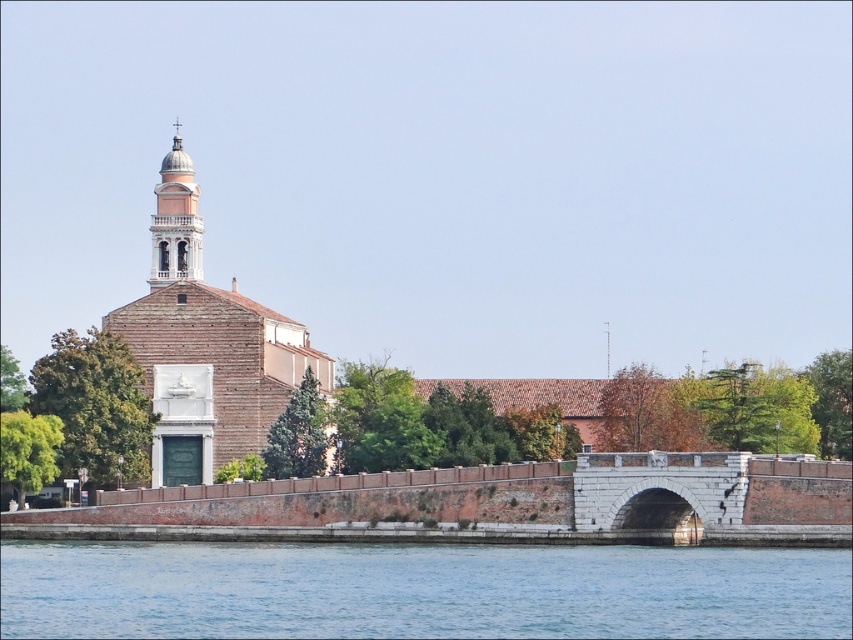
You are standing on the riverside path and want to cross to the other side. The white stone bridge at center is your only option. Can you see the blue water at lower center from the bridge?

Yes, because the blue water at lower center is in front of the white stone bridge at center, so when you are on the bridge, you can see the water in front of you.

You are standing on the riverside path and want to cross to the other side. The stone bridge you see can only support objects narrower than the light pink stone bell tower at upper left. Can you safely cross the bridge with a boat that is as wide as the blue water at lower center?

The blue water at lower center is wider than the light pink stone bell tower at upper left. Since the boat is as wide as the blue water at lower center, it is wider than the maximum width the bridge can support, so you cannot safely cross the bridge with the boat.

You are a boat captain trying to navigate a small boat that is 10 meters long through the river. You see the blue water at lower center and the white stone bridge at center in the image. Can your boat safely pass under the bridge without hitting it?

The blue water at lower center and the white stone bridge at center are 12.32 meters apart from each other. Since the boat is 10 meters long, it can safely pass under the bridge as there is enough space between the water and the bridge.